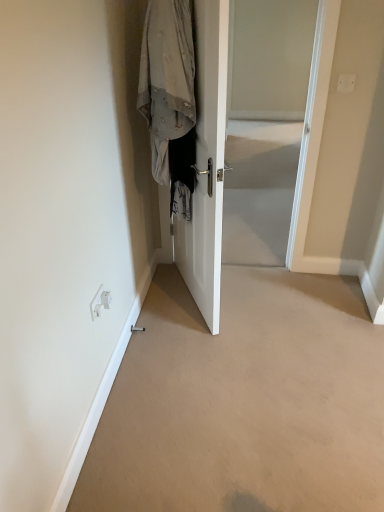
Where is `vacant space to the left of white glossy door at center`? Image resolution: width=384 pixels, height=512 pixels. vacant space to the left of white glossy door at center is located at coordinates (168, 290).